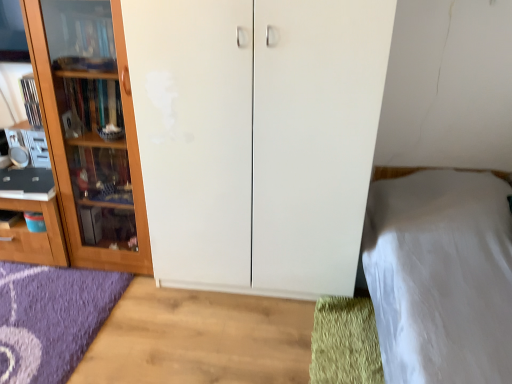
In order to face white matte cupboard at center, acting as the 1th cupboard starting from the right, should I rotate leftwards or rightwards?

To face it directly, rotate right by 0.696 degrees.

Image resolution: width=512 pixels, height=384 pixels. What do you see at coordinates (345, 342) in the screenshot?
I see `green shaggy doormat at lower right` at bounding box center [345, 342].

I want to click on white smooth bed at right, so pos(441,276).

Looking at this image, considering the sizes of white matte cupboard at center, acting as the 1th cupboard starting from the right, and wooden cabinet at left, the second cupboard when ordered from right to left, in the image, is white matte cupboard at center, acting as the 1th cupboard starting from the right, taller or shorter than wooden cabinet at left, the second cupboard when ordered from right to left,?

white matte cupboard at center, acting as the 1th cupboard starting from the right, is taller than wooden cabinet at left, the second cupboard when ordered from right to left.

From the image's perspective, is white matte cupboard at center, the second cupboard positioned from the left, located above or below wooden cabinet at left, the second cupboard when ordered from right to left?

Based on their image positions, white matte cupboard at center, the second cupboard positioned from the left, is located beneath wooden cabinet at left, the second cupboard when ordered from right to left.

Would you say white matte cupboard at center, acting as the 1th cupboard starting from the right, is outside wooden cabinet at left, the second cupboard when ordered from right to left?

white matte cupboard at center, acting as the 1th cupboard starting from the right, lies outside wooden cabinet at left, the second cupboard when ordered from right to left,'s area.

From the picture: Between wooden cabinet at left, the 1th cupboard viewed from the left, and green shaggy doormat at lower right, which one has larger width?

Wider between the two is wooden cabinet at left, the 1th cupboard viewed from the left.

Is wooden cabinet at left, the second cupboard when ordered from right to left, further to camera compared to green shaggy doormat at lower right?

Yes, wooden cabinet at left, the second cupboard when ordered from right to left, is further from the viewer.

At what (x,y) coordinates should I click in order to perform the action: click on doormat below the wooden cabinet at left, the second cupboard when ordered from right to left (from the image's perspective). Please return your answer as a coordinate pair (x, y). The image size is (512, 384). Looking at the image, I should click on (345, 342).

Which is in front, point (116, 79) or point (368, 313)?

Point (116, 79)

Considering the sizes of objects green shaggy doormat at lower right and wooden cabinet at left, the second cupboard when ordered from right to left, in the image provided, who is smaller, green shaggy doormat at lower right or wooden cabinet at left, the second cupboard when ordered from right to left,?

green shaggy doormat at lower right.

Is green shaggy doormat at lower right next to wooden cabinet at left, the 1th cupboard viewed from the left, and touching it?

green shaggy doormat at lower right and wooden cabinet at left, the 1th cupboard viewed from the left, are clearly separated.

From the picture: Based on their positions, is green shaggy doormat at lower right located to the left or right of wooden cabinet at left, the 1th cupboard viewed from the left?

green shaggy doormat at lower right is positioned on wooden cabinet at left, the 1th cupboard viewed from the left,'s right side.

Consider the image. Considering the sizes of green shaggy doormat at lower right and wooden cabinet at left, the second cupboard when ordered from right to left, in the image, is green shaggy doormat at lower right taller or shorter than wooden cabinet at left, the second cupboard when ordered from right to left,?

In the image, green shaggy doormat at lower right appears to be shorter than wooden cabinet at left, the second cupboard when ordered from right to left.

How different are the orientations of green shaggy doormat at lower right and white smooth bed at right in degrees?

0.266 degrees.

Are green shaggy doormat at lower right and white smooth bed at right far apart?

They are positioned close to each other.

Is green shaggy doormat at lower right in front of or behind white smooth bed at right in the image?

Visually, green shaggy doormat at lower right is located behind white smooth bed at right.

Which of these two, green shaggy doormat at lower right or white smooth bed at right, is smaller?

Smaller between the two is green shaggy doormat at lower right.

From the picture: From a real-world perspective, is white smooth bed at right located beneath white matte cupboard at center, acting as the 1th cupboard starting from the right?

Yes, from a real-world perspective, white smooth bed at right is beneath white matte cupboard at center, acting as the 1th cupboard starting from the right.

From the image's perspective, is white smooth bed at right below white matte cupboard at center, the second cupboard positioned from the left?

Yes, from the image's perspective, white smooth bed at right is beneath white matte cupboard at center, the second cupboard positioned from the left.

Is white smooth bed at right taller than white matte cupboard at center, acting as the 1th cupboard starting from the right?

No.

Is white matte cupboard at center, the second cupboard positioned from the left, surrounded by white smooth bed at right?

No, white matte cupboard at center, the second cupboard positioned from the left, is not a part of white smooth bed at right.

Can we say white smooth bed at right lies outside green shaggy doormat at lower right?

Yes, white smooth bed at right is outside of green shaggy doormat at lower right.

Is white smooth bed at right taller or shorter than green shaggy doormat at lower right?

Clearly, white smooth bed at right is taller compared to green shaggy doormat at lower right.

Is white smooth bed at right to the right of green shaggy doormat at lower right from the viewer's perspective?

Yes, white smooth bed at right is to the right of green shaggy doormat at lower right.

How many degrees apart are the facing directions of white smooth bed at right and green shaggy doormat at lower right?

The angle between the facing direction of white smooth bed at right and the facing direction of green shaggy doormat at lower right is 0.266 degrees.

Which of these two, wooden cabinet at left, the second cupboard when ordered from right to left, or white smooth bed at right, is bigger?

With larger size is white smooth bed at right.

This screenshot has width=512, height=384. What are the coordinates of `bed in front of the wooden cabinet at left, the 1th cupboard viewed from the left` in the screenshot? It's located at (441, 276).

Is wooden cabinet at left, the 1th cupboard viewed from the left, turned away from white smooth bed at right?

wooden cabinet at left, the 1th cupboard viewed from the left, is not turned away from white smooth bed at right.

Is wooden cabinet at left, the second cupboard when ordered from right to left, with white smooth bed at right?

No, wooden cabinet at left, the second cupboard when ordered from right to left, is not in contact with white smooth bed at right.

Where is `cupboard above the white matte cupboard at center, acting as the 1th cupboard starting from the right (from the image's perspective)`? This screenshot has height=384, width=512. cupboard above the white matte cupboard at center, acting as the 1th cupboard starting from the right (from the image's perspective) is located at coordinates (90, 130).

Locate an element on the screen. This screenshot has height=384, width=512. doormat that appears on the right of wooden cabinet at left, the 1th cupboard viewed from the left is located at coordinates pos(345,342).

Which object lies nearer to the anchor point wooden cabinet at left, the second cupboard when ordered from right to left, green shaggy doormat at lower right or white matte cupboard at center, the second cupboard positioned from the left?

Based on the image, white matte cupboard at center, the second cupboard positioned from the left, appears to be nearer to wooden cabinet at left, the second cupboard when ordered from right to left.

Estimate the real-world distances between objects in this image. Which object is closer to green shaggy doormat at lower right, wooden cabinet at left, the 1th cupboard viewed from the left, or white matte cupboard at center, the second cupboard positioned from the left?

white matte cupboard at center, the second cupboard positioned from the left, lies closer to green shaggy doormat at lower right than the other object.

From the image, which object appears to be nearer to wooden cabinet at left, the 1th cupboard viewed from the left, white matte cupboard at center, the second cupboard positioned from the left, or white smooth bed at right?

Among the two, white matte cupboard at center, the second cupboard positioned from the left, is located nearer to wooden cabinet at left, the 1th cupboard viewed from the left.

Based on their spatial positions, is white matte cupboard at center, the second cupboard positioned from the left, or white smooth bed at right further from green shaggy doormat at lower right?

Among the two, white matte cupboard at center, the second cupboard positioned from the left, is located further to green shaggy doormat at lower right.

Looking at the image, which one is located closer to white matte cupboard at center, acting as the 1th cupboard starting from the right, wooden cabinet at left, the second cupboard when ordered from right to left, or white smooth bed at right?

wooden cabinet at left, the second cupboard when ordered from right to left, is positioned closer to the anchor white matte cupboard at center, acting as the 1th cupboard starting from the right.

Looking at this image, estimate the real-world distances between objects in this image. Which object is closer to green shaggy doormat at lower right, wooden cabinet at left, the 1th cupboard viewed from the left, or white smooth bed at right?

white smooth bed at right lies closer to green shaggy doormat at lower right than the other object.

When comparing their distances from white smooth bed at right, does wooden cabinet at left, the 1th cupboard viewed from the left, or green shaggy doormat at lower right seem further?

Among the two, wooden cabinet at left, the 1th cupboard viewed from the left, is located further to white smooth bed at right.

From the image, which object appears to be nearer to white smooth bed at right, green shaggy doormat at lower right or white matte cupboard at center, the second cupboard positioned from the left?

green shaggy doormat at lower right is closer to white smooth bed at right.

Where is `cupboard located between wooden cabinet at left, the second cupboard when ordered from right to left, and green shaggy doormat at lower right in the left-right direction`? The width and height of the screenshot is (512, 384). cupboard located between wooden cabinet at left, the second cupboard when ordered from right to left, and green shaggy doormat at lower right in the left-right direction is located at coordinates (257, 139).

The width and height of the screenshot is (512, 384). What are the coordinates of `cupboard between white smooth bed at right and green shaggy doormat at lower right from front to back` in the screenshot? It's located at (257, 139).

Where is `doormat situated between wooden cabinet at left, the 1th cupboard viewed from the left, and white smooth bed at right from left to right`? This screenshot has height=384, width=512. doormat situated between wooden cabinet at left, the 1th cupboard viewed from the left, and white smooth bed at right from left to right is located at coordinates (x=345, y=342).

This screenshot has width=512, height=384. What are the coordinates of `cupboard between wooden cabinet at left, the 1th cupboard viewed from the left, and white smooth bed at right, in the horizontal direction` in the screenshot? It's located at (257, 139).